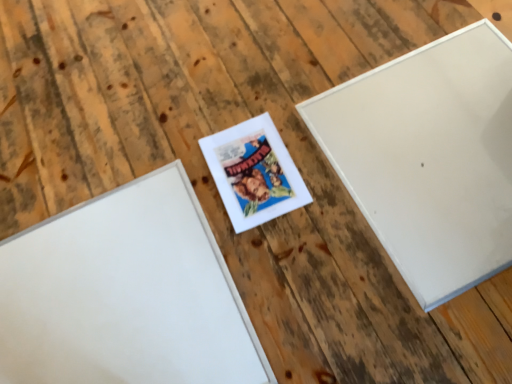
Identify the location of vacant space underneath white matte picture frame at center, positioned as the 3th picture frame in right-to-left order (from a real-world perspective). This screenshot has height=384, width=512. (113, 299).